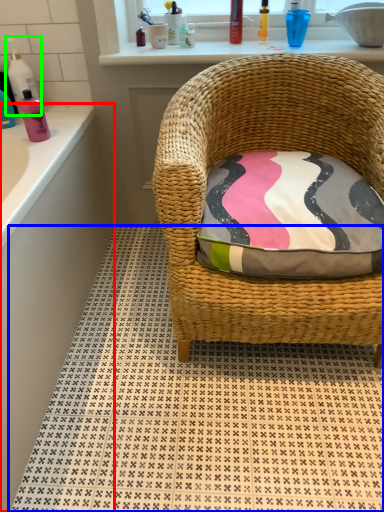
Question: Which object is the closest to the bath (highlighted by a red box)? Choose among these: pattern (highlighted by a blue box) or cleaning product (highlighted by a green box).

Choices:
 (A) pattern
 (B) cleaning product

Answer: (A)